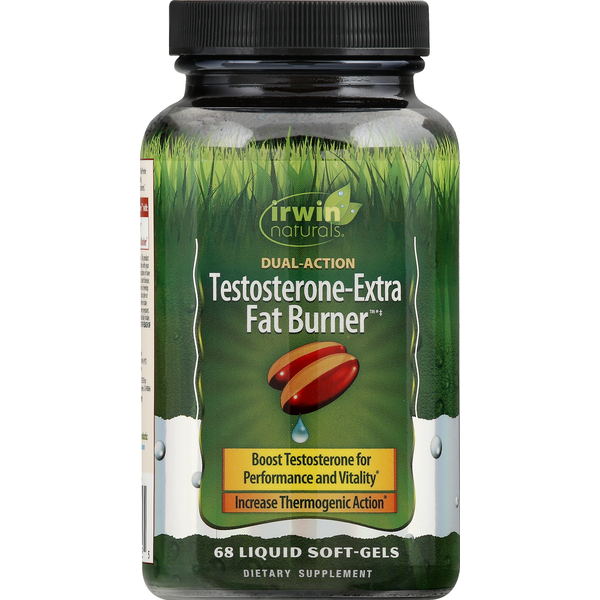
Locate an element on the screen. The height and width of the screenshot is (600, 600). decoration is located at coordinates (417, 363), (196, 348).